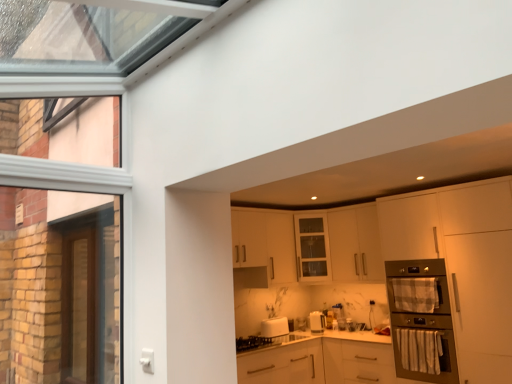
Question: Relative to brown wooden screen door at left, is white matte cabinet at upper center, which is counted as the 1th cabinetry, starting from the top, in front or behind?

Choices:
 (A) front
 (B) behind

Answer: (B)

Question: In terms of width, does white matte cabinet at upper center, which is counted as the 1th cabinetry, starting from the top, look wider or thinner when compared to brown wooden screen door at left?

Choices:
 (A) wide
 (B) thin

Answer: (A)

Question: Which object is positioned closest to the white glossy toaster at lower center?

Choices:
 (A) white matte oven at right, marked as the second cabinetry in a bottom-to-top arrangement
 (B) white matte cabinet at upper center, arranged as the 3th cabinetry when ordered from the bottom
 (C) brown wooden screen door at left
 (D) white matte cabinet at lower center, the 1th cabinetry positioned from the bottom
 (E) metallic stainless steel oven at right

Answer: (D)

Question: Estimate the real-world distances between objects in this image. Which object is closer to the metallic stainless steel oven at right?

Choices:
 (A) white matte cabinet at lower center, the 1th cabinetry positioned from the bottom
 (B) brown wooden screen door at left
 (C) white glossy toaster at lower center
 (D) white matte cabinet at upper center, which is counted as the 1th cabinetry, starting from the top
 (E) plaid fabric oven door at right

Answer: (E)